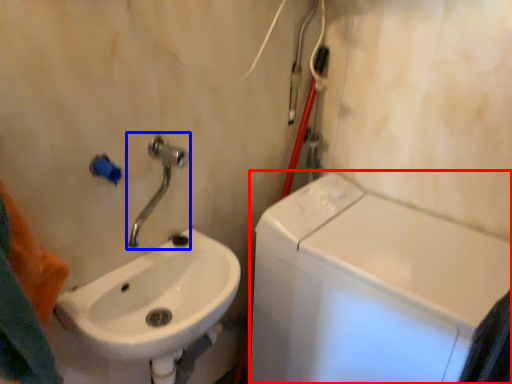
Question: Which object appears farthest to the camera in this image, washing machine (highlighted by a red box) or tap (highlighted by a blue box)?

Choices:
 (A) washing machine
 (B) tap

Answer: (A)